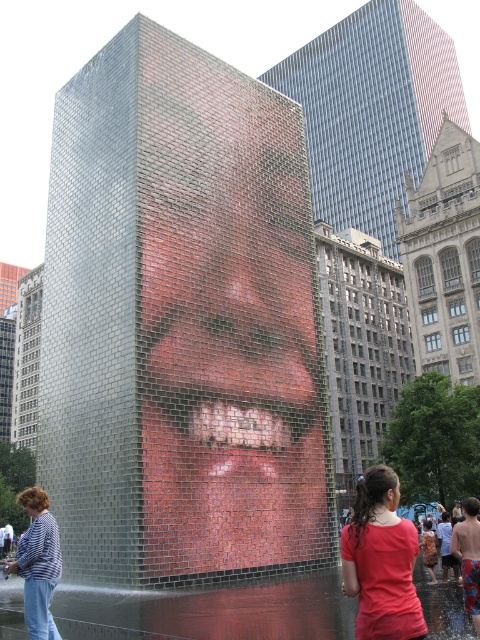
Question: Does striped fabric shirt at lower left have a smaller size compared to orange printed dress at lower center?

Choices:
 (A) yes
 (B) no

Answer: (B)

Question: Which of the following is the closest to the observer?

Choices:
 (A) (411, 611)
 (B) (33, 541)
 (C) (186, 346)

Answer: (A)

Question: Which of the following is the farthest from the observer?

Choices:
 (A) orange printed dress at lower center
 (B) striped fabric shirt at lower left
 (C) matte red shirt at lower right
 (D) metallic mosaic face at center

Answer: (A)

Question: Is metallic mosaic face at center positioned in front of orange printed dress at lower center?

Choices:
 (A) no
 (B) yes

Answer: (B)

Question: Which point appears farthest from the camera in this image?

Choices:
 (A) (43, 616)
 (B) (230, 342)
 (C) (418, 636)

Answer: (B)

Question: Does metallic mosaic face at center have a smaller size compared to striped fabric shirt at lower left?

Choices:
 (A) no
 (B) yes

Answer: (A)